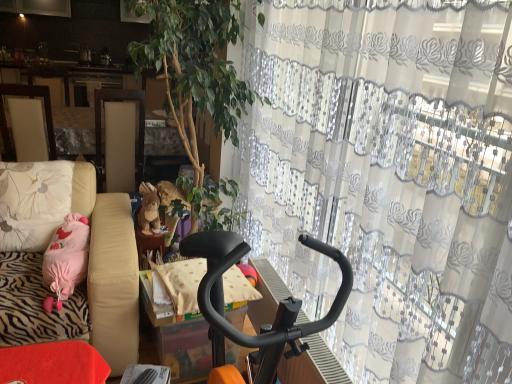
Question: From the image's perspective, is black textured cushion at center on black plastic exercise bike at center?

Choices:
 (A) yes
 (B) no

Answer: (A)

Question: Is black textured cushion at center wider than black plastic exercise bike at center?

Choices:
 (A) yes
 (B) no

Answer: (B)

Question: Is black textured cushion at center completely or partially outside of black plastic exercise bike at center?

Choices:
 (A) yes
 (B) no

Answer: (B)

Question: Is black textured cushion at center aimed at black plastic exercise bike at center?

Choices:
 (A) yes
 (B) no

Answer: (B)

Question: Considering the relative positions of black textured cushion at center and black plastic exercise bike at center in the image provided, is black textured cushion at center in front of black plastic exercise bike at center?

Choices:
 (A) yes
 (B) no

Answer: (B)

Question: From a real-world perspective, is green leafy plant at center above or below black plastic exercise bike at center?

Choices:
 (A) below
 (B) above

Answer: (B)

Question: Considering the positions of green leafy plant at center and black plastic exercise bike at center in the image, is green leafy plant at center taller or shorter than black plastic exercise bike at center?

Choices:
 (A) short
 (B) tall

Answer: (B)

Question: Considering their positions, is green leafy plant at center located in front of or behind black plastic exercise bike at center?

Choices:
 (A) front
 (B) behind

Answer: (B)

Question: Is green leafy plant at center inside or outside of black plastic exercise bike at center?

Choices:
 (A) inside
 (B) outside

Answer: (B)

Question: From a real-world perspective, is green leafy plant at center positioned above or below brown plush rabbit at center?

Choices:
 (A) above
 (B) below

Answer: (A)

Question: Visually, is green leafy plant at center positioned to the left or to the right of brown plush rabbit at center?

Choices:
 (A) left
 (B) right

Answer: (B)

Question: Does point (177, 82) appear closer or farther from the camera than point (137, 216)?

Choices:
 (A) farther
 (B) closer

Answer: (A)

Question: In terms of width, does green leafy plant at center look wider or thinner when compared to brown plush rabbit at center?

Choices:
 (A) wide
 (B) thin

Answer: (A)

Question: Is brown plush rabbit at center inside or outside of black textured cushion at center?

Choices:
 (A) outside
 (B) inside

Answer: (A)

Question: Is brown plush rabbit at center taller or shorter than black textured cushion at center?

Choices:
 (A) tall
 (B) short

Answer: (A)